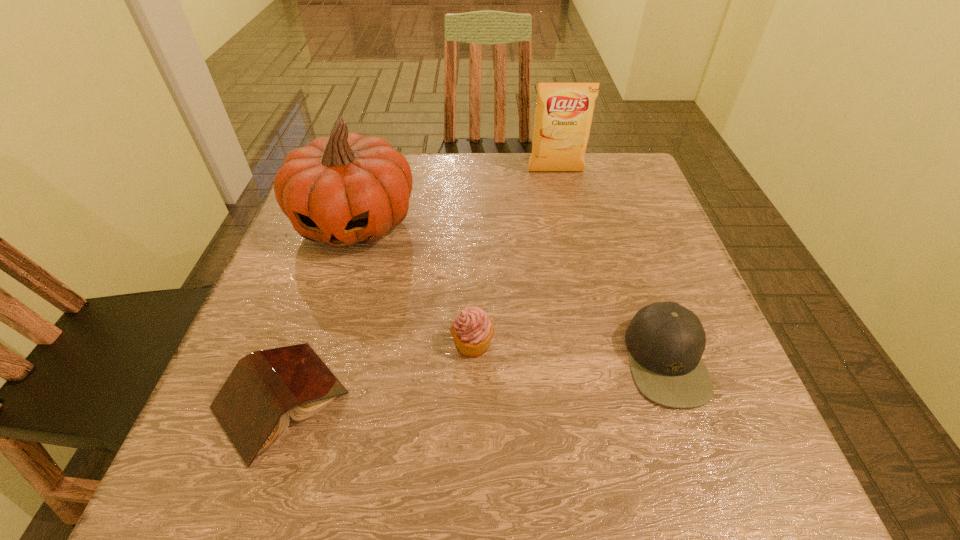
This screenshot has width=960, height=540. What are the coordinates of `the farthest object` in the screenshot? It's located at 563,116.

You are a GUI agent. You are given a task and a screenshot of the screen. Output one action in this format:
    pyautogui.click(x=<x>, y=<y>)
    Task: Click on the pumpkin
    This screenshot has height=540, width=960.
    Given the screenshot: What is the action you would take?
    pyautogui.click(x=346, y=189)

Where is `cupcake`? This screenshot has width=960, height=540. cupcake is located at coordinates (472, 330).

Where is `cap`? This screenshot has height=540, width=960. cap is located at coordinates (666, 341).

You are a GUI agent. You are given a task and a screenshot of the screen. Output one action in this format:
    pyautogui.click(x=<x>, y=<y>)
    Task: Click on the book
    Image resolution: width=960 pixels, height=540 pixels.
    Given the screenshot: What is the action you would take?
    pyautogui.click(x=253, y=406)

The height and width of the screenshot is (540, 960). Find the location of `vacant space situated 0.340m on the front of the crisp (potato chip) with the logo`. vacant space situated 0.340m on the front of the crisp (potato chip) with the logo is located at coordinates (577, 272).

You are a GUI agent. You are given a task and a screenshot of the screen. Output one action in this format:
    pyautogui.click(x=<x>, y=<y>)
    Task: Click on the free point located on the face of the pumpkin
    Image resolution: width=960 pixels, height=540 pixels.
    Given the screenshot: What is the action you would take?
    pyautogui.click(x=299, y=406)

You are a GUI agent. You are given a task and a screenshot of the screen. Output one action in this format:
    pyautogui.click(x=<x>, y=<y>)
    Task: Click on the vacant space situated 0.190m on the back of the cupcake
    Image resolution: width=960 pixels, height=540 pixels.
    Given the screenshot: What is the action you would take?
    pyautogui.click(x=474, y=254)

Locate an element on the screen. The height and width of the screenshot is (540, 960). free space located 0.160m on the brim of the cap is located at coordinates (533, 360).

Locate an element on the screen. Image resolution: width=960 pixels, height=540 pixels. vacant area situated 0.350m on the brim of the cap is located at coordinates (420, 360).